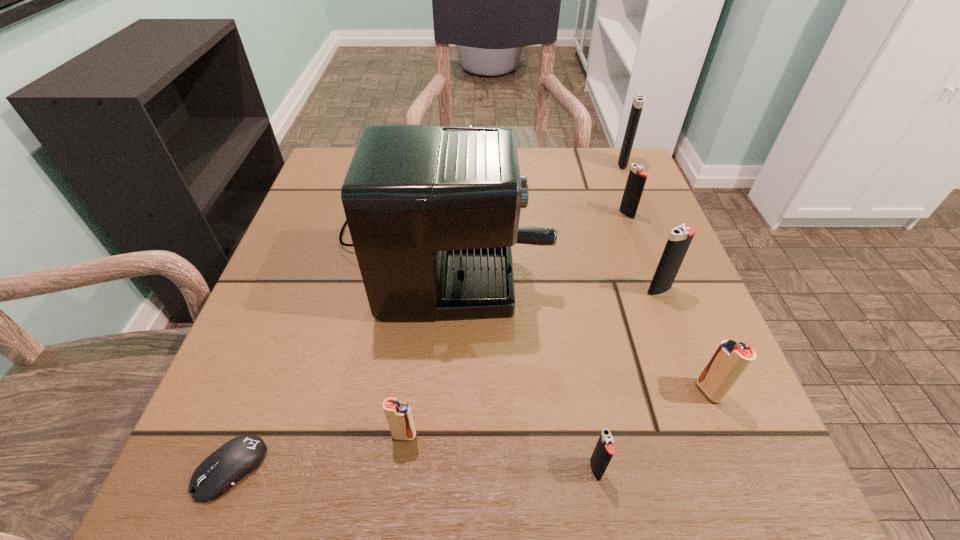
At what (x,y) coordinates should I click in order to perform the action: click on the left red igniter. Please return your answer as a coordinate pair (x, y). The height and width of the screenshot is (540, 960). Looking at the image, I should click on (399, 416).

Image resolution: width=960 pixels, height=540 pixels. Identify the location of the leftmost igniter. (399, 416).

This screenshot has height=540, width=960. In order to click on the nearest igniter in this screenshot , I will do `click(604, 450)`.

Locate an element on the screen. The width and height of the screenshot is (960, 540). the fifth object from right to left is located at coordinates (604, 450).

This screenshot has height=540, width=960. What are the coordinates of `computer equipment` in the screenshot? It's located at (219, 472).

Locate an element on the screen. black computer equipment is located at coordinates (219, 472).

You are a GUI agent. You are given a task and a screenshot of the screen. Output one action in this format:
    pyautogui.click(x=<x>, y=<y>)
    Task: Click on the blank space located on the front-facing side of the black coffee maker
    The width and height of the screenshot is (960, 540).
    Given the screenshot: What is the action you would take?
    pyautogui.click(x=618, y=232)

Find the location of a particular element. The height and width of the screenshot is (540, 960). vacant space located 0.290m on the left of the biggest black igniter is located at coordinates (500, 164).

Where is `free location located on the back of the second tallest igniter`? free location located on the back of the second tallest igniter is located at coordinates (620, 187).

This screenshot has height=540, width=960. In order to click on free space located on the front of the second smallest black igniter in this screenshot , I will do `click(659, 301)`.